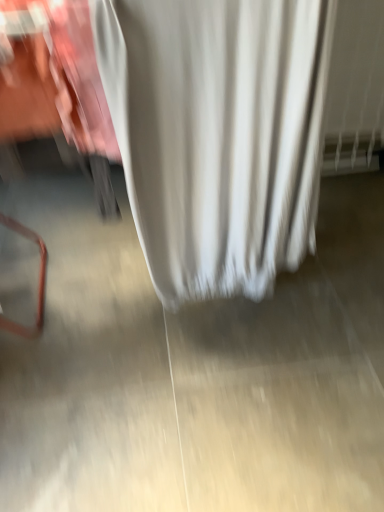
Question: Looking at the image, does white fabric curtain at center seem bigger or smaller compared to smooth concrete floor at center?

Choices:
 (A) big
 (B) small

Answer: (A)

Question: Is white fabric curtain at center taller or shorter than smooth concrete floor at center?

Choices:
 (A) tall
 (B) short

Answer: (A)

Question: Does point click(172, 241) appear closer or farther from the camera than point click(107, 366)?

Choices:
 (A) closer
 (B) farther

Answer: (A)

Question: In terms of width, does smooth concrete floor at center look wider or thinner when compared to white fabric curtain at center?

Choices:
 (A) thin
 (B) wide

Answer: (B)

Question: In terms of height, does smooth concrete floor at center look taller or shorter compared to white fabric curtain at center?

Choices:
 (A) short
 (B) tall

Answer: (A)

Question: In terms of size, does smooth concrete floor at center appear bigger or smaller than white fabric curtain at center?

Choices:
 (A) big
 (B) small

Answer: (B)

Question: From a real-world perspective, is smooth concrete floor at center above or below white fabric curtain at center?

Choices:
 (A) below
 (B) above

Answer: (A)